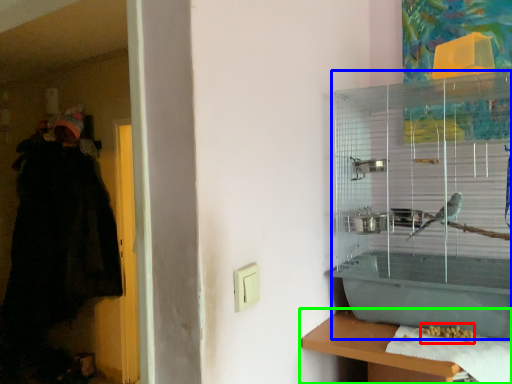
Question: Estimate the real-world distances between objects in this image. Which object is farther from food (highlighted by a red box), bird cage (highlighted by a blue box) or shelf (highlighted by a green box)?

Choices:
 (A) bird cage
 (B) shelf

Answer: (A)